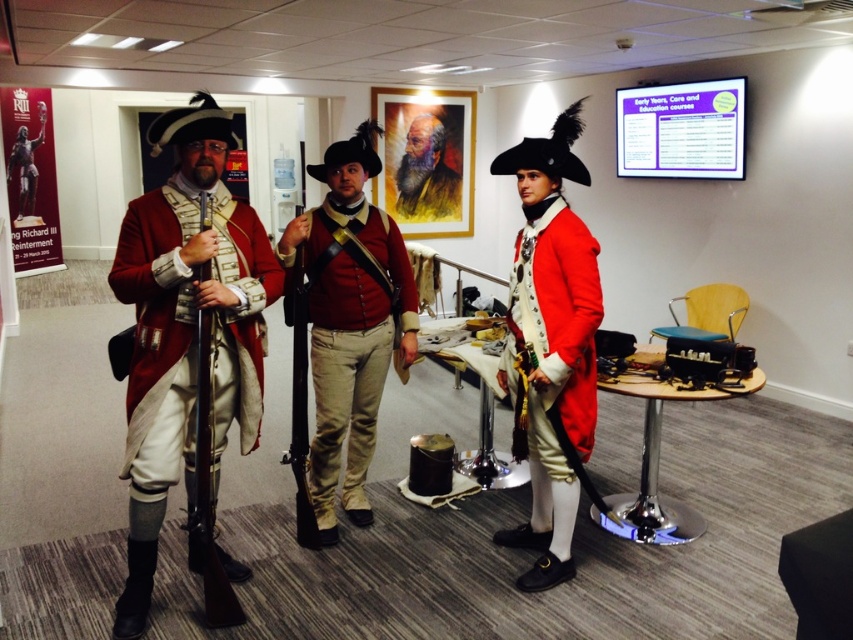
Question: Which object is the farthest from the matte red vest at center?

Choices:
 (A) watercolor portrait of man with long beard at center
 (B) matte red coat at left

Answer: (A)

Question: Can you confirm if matte red coat at center is thinner than wooden smooth rifle at center?

Choices:
 (A) yes
 (B) no

Answer: (B)

Question: Does matte red coat at center have a greater width compared to watercolor portrait of man with long beard at center?

Choices:
 (A) no
 (B) yes

Answer: (A)

Question: Is matte red vest at center to the right of wooden smooth rifle at center from the viewer's perspective?

Choices:
 (A) yes
 (B) no

Answer: (A)

Question: Among these points, which one is farthest from the camera?

Choices:
 (A) (177, 378)
 (B) (433, 193)
 (C) (407, 269)

Answer: (B)

Question: Which object is positioned farthest from the matte red coat at center?

Choices:
 (A) matte red coat at left
 (B) watercolor portrait of man with long beard at center
 (C) matte red vest at center

Answer: (B)